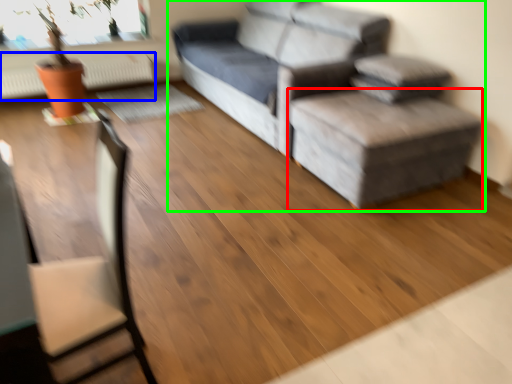
Question: Which object is the closest to the stool (highlighted by a red box)? Choose among these: radiator (highlighted by a blue box) or studio couch (highlighted by a green box).

Choices:
 (A) radiator
 (B) studio couch

Answer: (B)